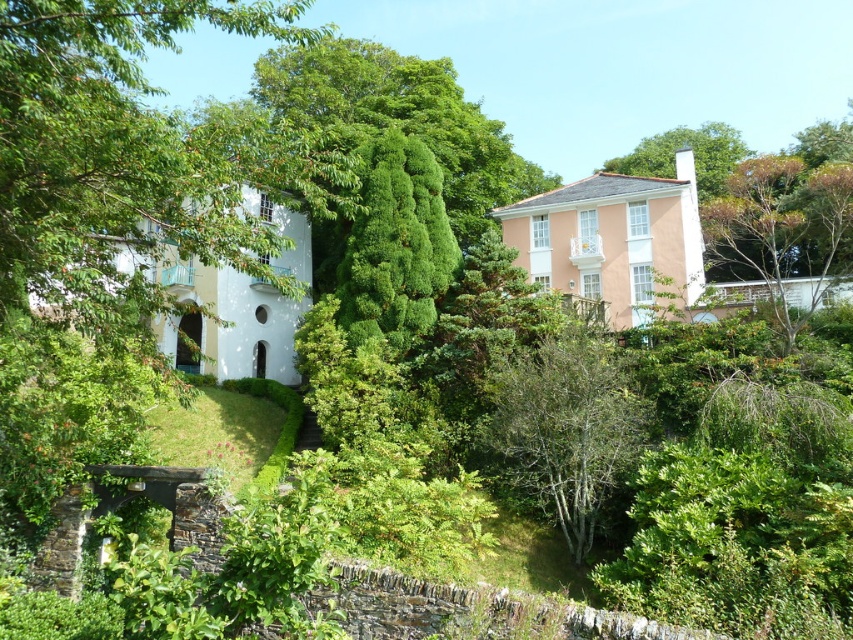
Does brown textured tree at upper right have a greater height compared to green leafy tree at upper right?

Incorrect, brown textured tree at upper right's height is not larger of green leafy tree at upper right's.

Which of these two, brown textured tree at upper right or green leafy tree at upper right, stands shorter?

Standing shorter between the two is brown textured tree at upper right.

Measure the distance between brown textured tree at upper right and camera.

21.60 meters

Where is `brown textured tree at upper right`? The height and width of the screenshot is (640, 853). brown textured tree at upper right is located at coordinates (782, 228).

Describe the element at coordinates (395, 244) in the screenshot. I see `green needle-like at center` at that location.

From the picture: Between green needle-like at center and brown textured tree at upper right, which one appears on the left side from the viewer's perspective?

green needle-like at center is more to the left.

What do you see at coordinates (395, 244) in the screenshot? Image resolution: width=853 pixels, height=640 pixels. I see `green needle-like at center` at bounding box center [395, 244].

Where is `green needle-like at center`? This screenshot has width=853, height=640. green needle-like at center is located at coordinates (395, 244).

Who is positioned more to the right, green leafy tree at center or green leafy tree at upper right?

Positioned to the right is green leafy tree at upper right.

Between point (546, 420) and point (704, 193), which one is positioned behind?

The point (704, 193) is more distant.

This screenshot has width=853, height=640. Identify the location of green leafy tree at center. (567, 426).